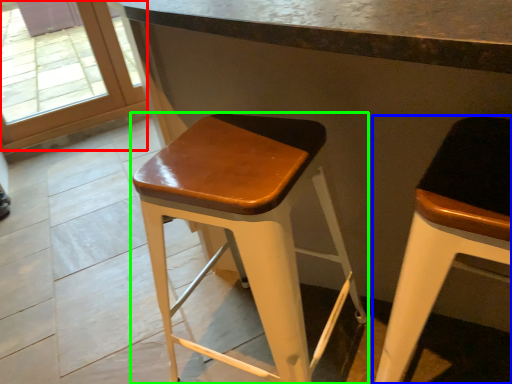
Question: Considering the real-world distances, which object is closest to glass door (highlighted by a red box)? stool (highlighted by a blue box) or stool (highlighted by a green box).

Choices:
 (A) stool
 (B) stool

Answer: (B)